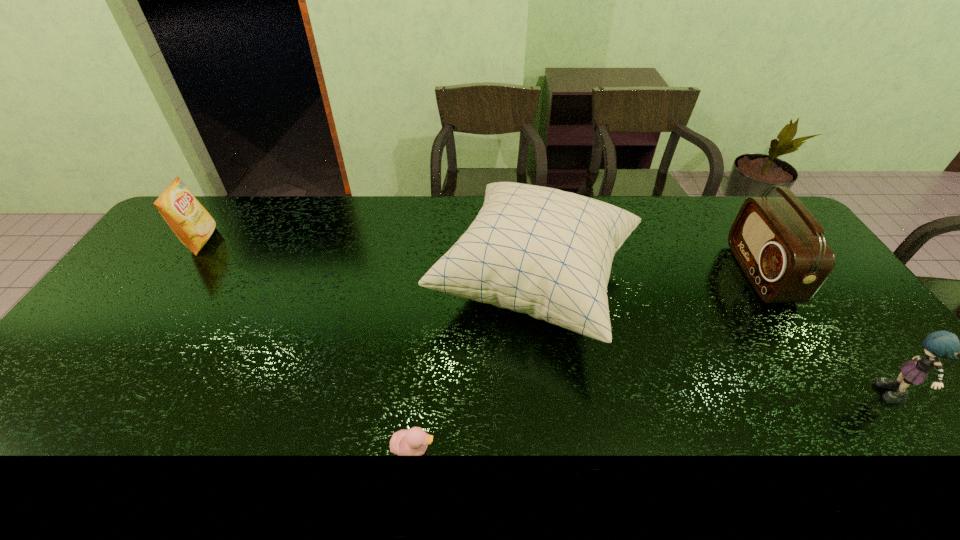
Locate an element on the screen. The height and width of the screenshot is (540, 960). radio receiver present at the right edge is located at coordinates (780, 246).

Where is `rag doll located in the right edge section of the desktop`? rag doll located in the right edge section of the desktop is located at coordinates (941, 344).

In order to click on object positioned at the far left corner in this screenshot , I will do `click(193, 225)`.

Image resolution: width=960 pixels, height=540 pixels. What are the coordinates of `free point at the far edge` in the screenshot? It's located at (437, 218).

The width and height of the screenshot is (960, 540). What are the coordinates of `vacant space at the near edge of the desktop` in the screenshot? It's located at (724, 433).

Locate an element on the screen. This screenshot has height=540, width=960. vacant space at the left edge of the desktop is located at coordinates (88, 407).

The width and height of the screenshot is (960, 540). I want to click on vacant space at the right edge of the desktop, so click(859, 332).

Where is `free space between the duckling and the leftmost object`? Image resolution: width=960 pixels, height=540 pixels. free space between the duckling and the leftmost object is located at coordinates (307, 345).

The image size is (960, 540). Identify the location of vacant area that lies between the shortest object and the rag doll. (654, 423).

Where is `unoccupied position between the radio receiver and the rag doll`? unoccupied position between the radio receiver and the rag doll is located at coordinates (827, 335).